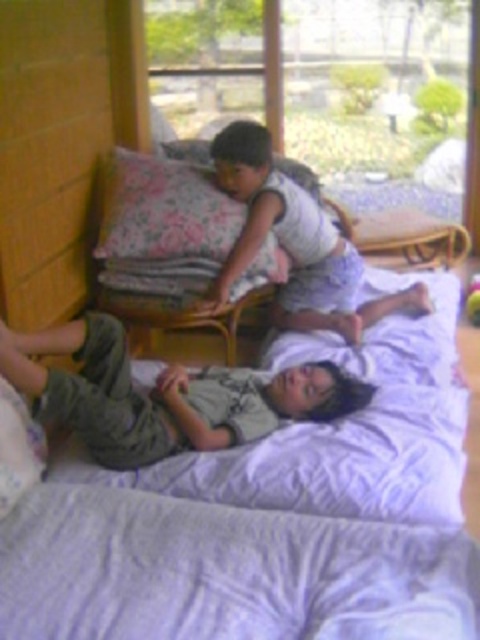
Can you confirm if white soft bed at lower center is bigger than green cotton pants at lower center?

Correct, white soft bed at lower center is larger in size than green cotton pants at lower center.

Is white soft bed at lower center behind green cotton pants at lower center?

That is False.

Which is in front, point (344, 621) or point (171, 401)?

Point (344, 621)

Locate an element on the screen. Image resolution: width=480 pixels, height=640 pixels. white soft bed at lower center is located at coordinates (271, 515).

Looking at this image, is green cotton pants at lower center below white cotton shirt at upper center?

Yes.

In the scene shown: Is green cotton pants at lower center taller than white cotton shirt at upper center?

No, green cotton pants at lower center is not taller than white cotton shirt at upper center.

Does point (156, 449) come in front of point (252, 163)?

Yes.

Where is `green cotton pants at lower center`? This screenshot has width=480, height=640. green cotton pants at lower center is located at coordinates (163, 394).

Is white soft bed at lower center thinner than white cotton shirt at upper center?

In fact, white soft bed at lower center might be wider than white cotton shirt at upper center.

Which is more to the right, white soft bed at lower center or white cotton shirt at upper center?

white soft bed at lower center

Describe the element at coordinates (271, 515) in the screenshot. The image size is (480, 640). I see `white soft bed at lower center` at that location.

This screenshot has height=640, width=480. In order to click on white soft bed at lower center in this screenshot , I will do `click(271, 515)`.